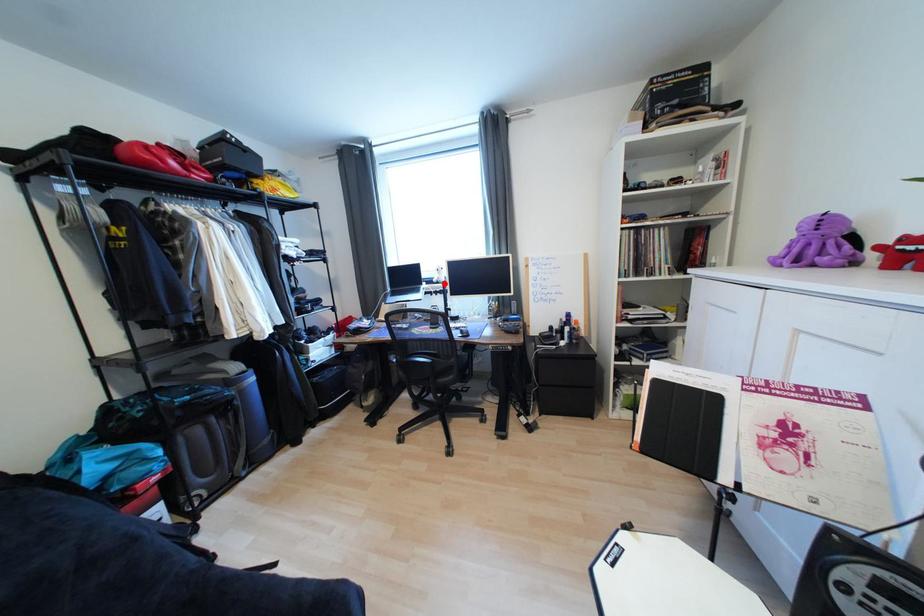
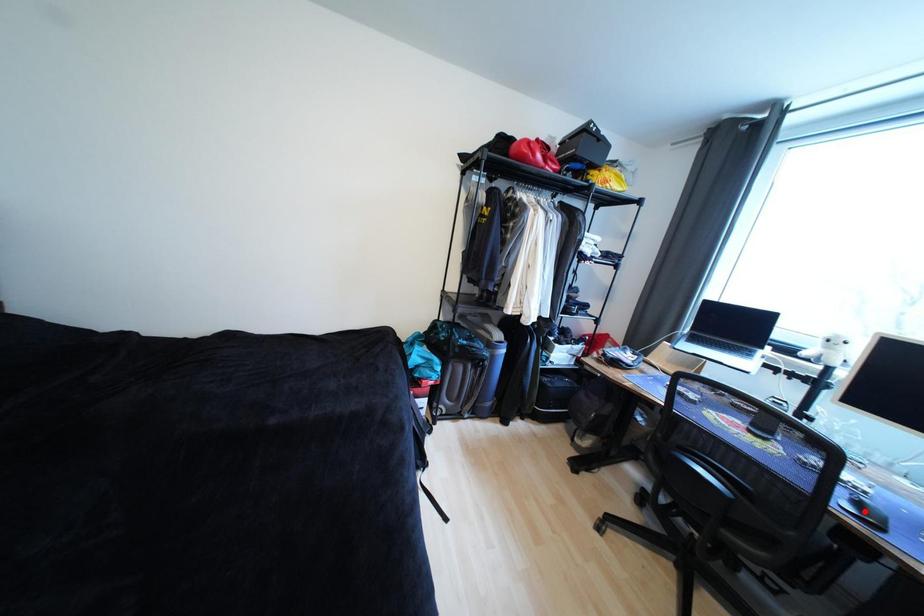
I am providing you with two images of the same scene from different viewpoints. A red point is marked on the first image and another point is marked on the second image. Is the red point in image1 aligned with the point shown in image2?

No